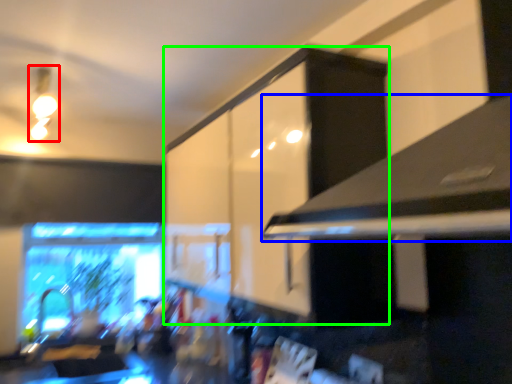
Question: Which object is positioned farthest from light fixture (highlighted by a red box)? Select from exhaust hood (highlighted by a blue box) and cabinetry (highlighted by a green box).

Choices:
 (A) exhaust hood
 (B) cabinetry

Answer: (A)